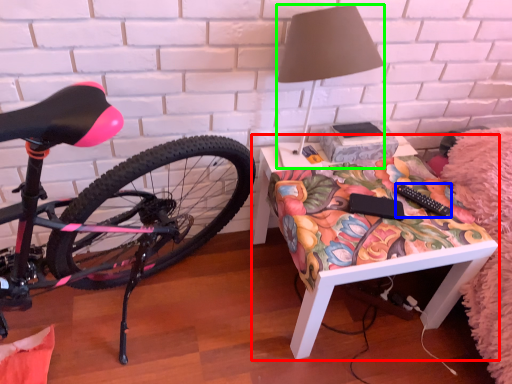
Question: Considering the real-world distances, which object is farthest from desk (highlighted by a red box)? remote control (highlighted by a blue box) or lamp (highlighted by a green box)?

Choices:
 (A) remote control
 (B) lamp

Answer: (B)